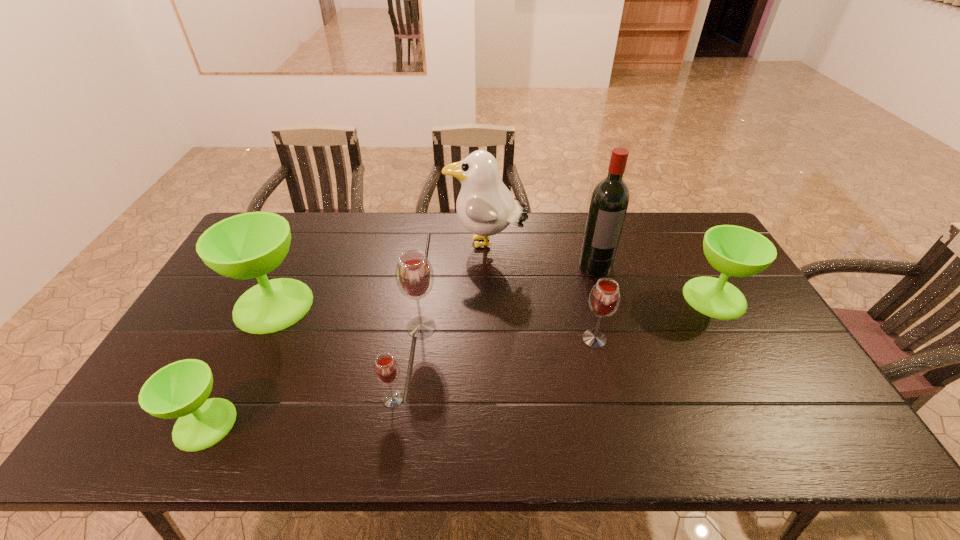
This screenshot has height=540, width=960. What are the coordinates of `vacant space located on the back of the smallest green wineglass` in the screenshot? It's located at (272, 291).

Find the location of a particular element. The width and height of the screenshot is (960, 540). object at the far edge is located at coordinates (485, 207).

Locate an element on the screen. The width and height of the screenshot is (960, 540). object that is at the near edge is located at coordinates (180, 390).

Find the location of `object located in the right edge section of the desktop`. object located in the right edge section of the desktop is located at coordinates (736, 251).

At what (x,y) coordinates should I click in order to perform the action: click on object located at the near left corner. Please return your answer as a coordinate pair (x, y). The image size is (960, 540). Looking at the image, I should click on (180, 390).

Identify the location of vacant space at the far edge of the desktop. The height and width of the screenshot is (540, 960). (551, 219).

The image size is (960, 540). In the image, there is a desktop. What are the coordinates of `vacant area at the near edge` in the screenshot? It's located at (417, 441).

In the image, there is a desktop. Identify the location of free space at the left edge. (250, 287).

Image resolution: width=960 pixels, height=540 pixels. I want to click on vacant space at the right edge, so click(x=733, y=336).

Where is `free location at the far right corner of the desktop`? This screenshot has height=540, width=960. free location at the far right corner of the desktop is located at coordinates (699, 247).